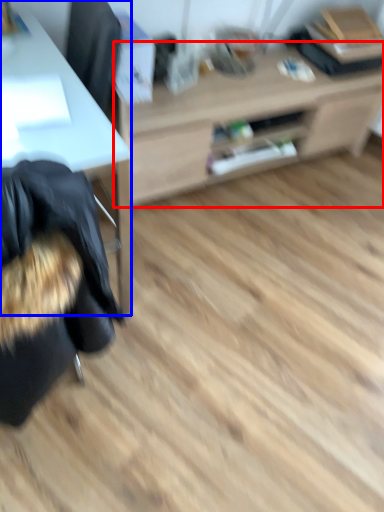
Question: Which object is further to the camera taking this photo, table (highlighted by a red box) or desk (highlighted by a blue box)?

Choices:
 (A) table
 (B) desk

Answer: (A)